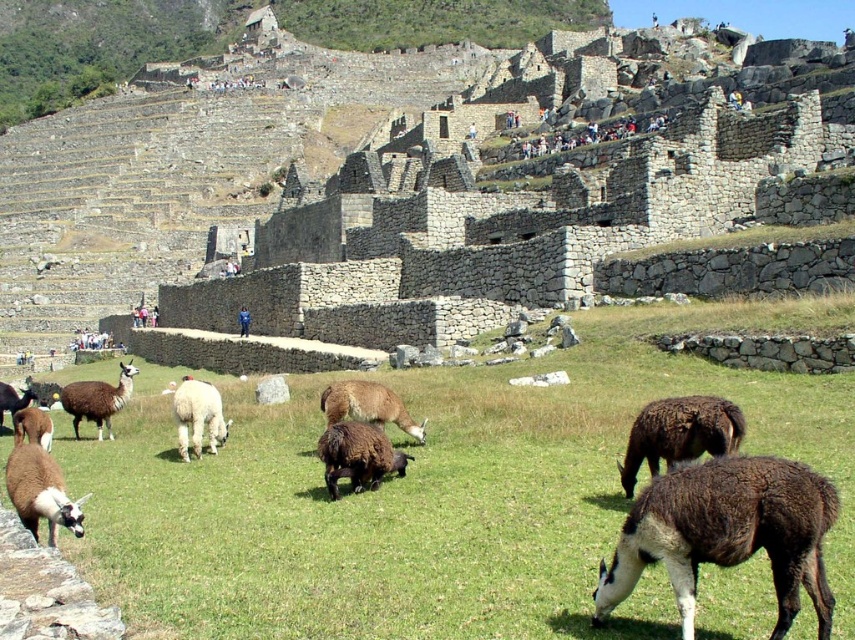
Question: Which point is farther to the camera?

Choices:
 (A) (685, 592)
 (B) (27, 499)
 (C) (86, 392)
 (D) (699, 586)

Answer: (C)

Question: Which object is closer to the camera taking this photo?

Choices:
 (A) brown woolen sheep at center
 (B) green grassy field at center
 (C) brown woolly alpaca at center-left
 (D) dark brown woolen llama at lower right

Answer: (B)

Question: Which point is farther to the camera?

Choices:
 (A) (63, 488)
 (B) (75, 406)
 (C) (598, 572)

Answer: (B)

Question: Does green grassy field at center appear under brown woolly llama at center-right?

Choices:
 (A) no
 (B) yes

Answer: (B)

Question: Is brown woolly llama at center-right positioned behind white woolen alpaca at lower left?

Choices:
 (A) no
 (B) yes

Answer: (B)

Question: Is green grassy field at center smaller than brown woolly alpaca at center?

Choices:
 (A) no
 (B) yes

Answer: (A)